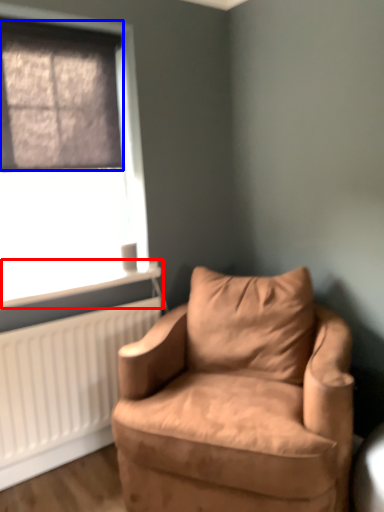
Question: Which of the following is the farthest to the observer, window sill (highlighted by a red box) or window screen (highlighted by a blue box)?

Choices:
 (A) window sill
 (B) window screen

Answer: (A)